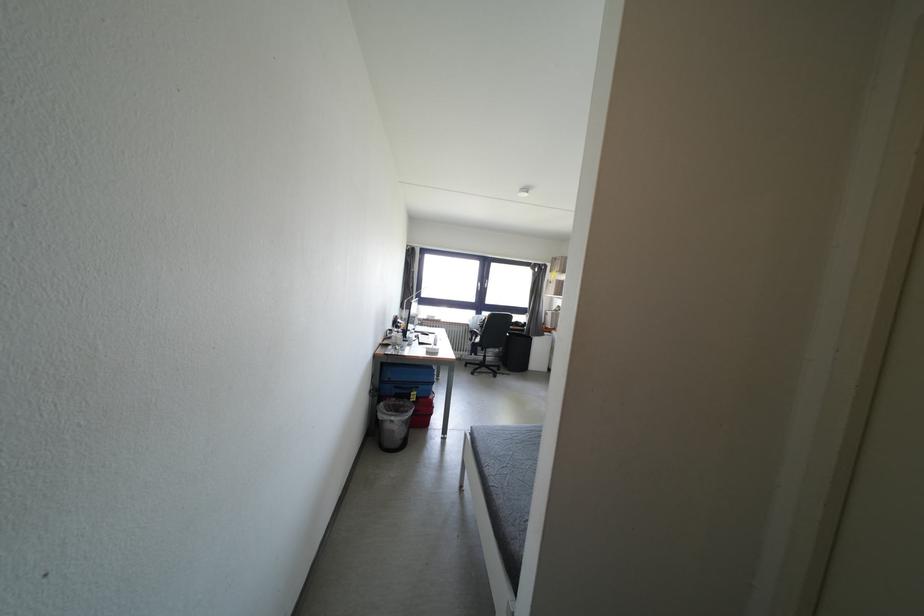
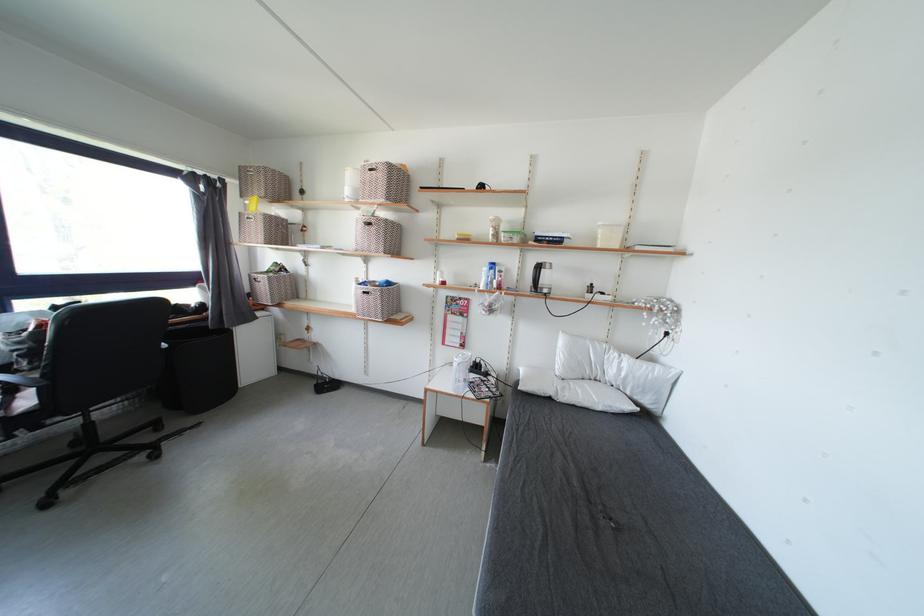
Locate, in the second image, the point that corresponds to point (484, 344) in the first image.

(33, 407)